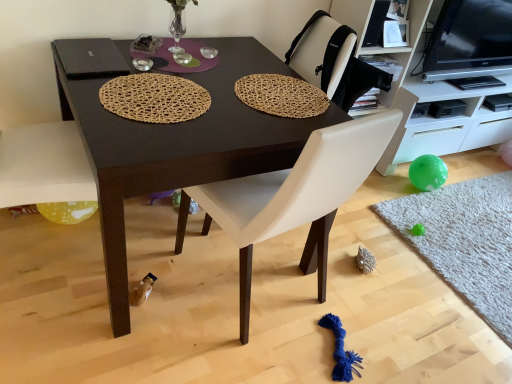
Find the location of a particular element. This screenshot has width=512, height=384. vacant region to the left of gray shaggy rug at lower right, the third mat from the left is located at coordinates (349, 272).